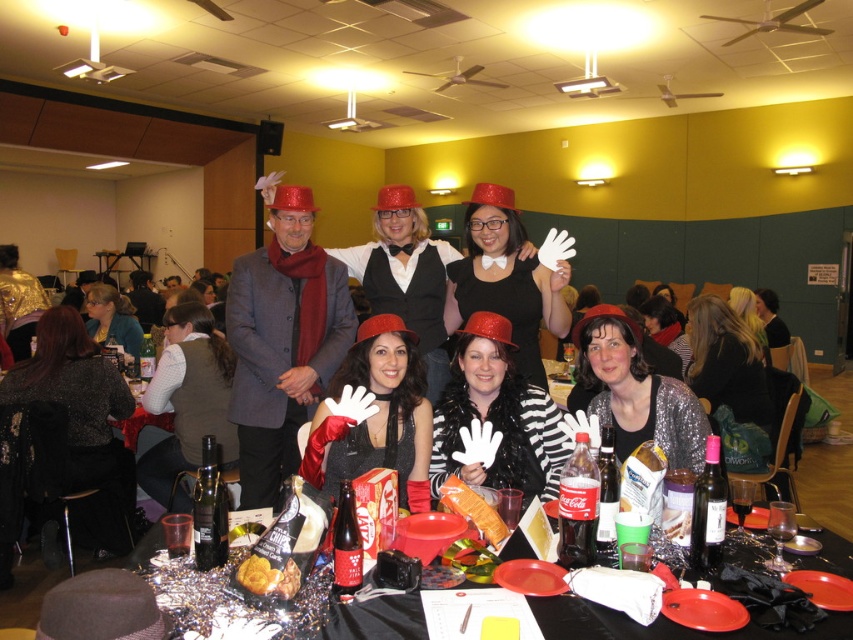
Consider the image. You are at a party and want to find the sparkly black dress at lower left. Where should you look relative to the white matte gloves at center?

The sparkly black dress at lower left is located below the white matte gloves at center, so look downward from the white matte gloves at center to find it.

You are a guest at the party and want to place both the velvet brown vest at lower left and the golden crispy pastry at center on a small plate that can only hold one item. Which item should you choose to place on the plate?

The golden crispy pastry at center should be placed on the plate because the velvet brown vest at lower left is larger in size and won